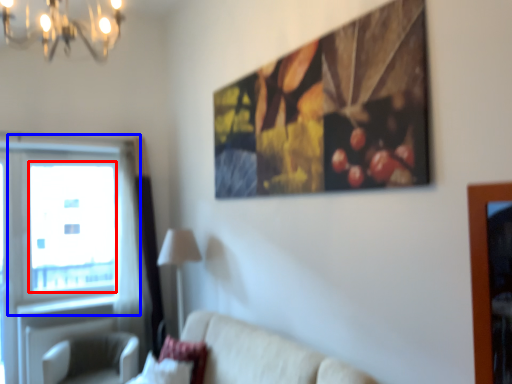
Question: Which of the following is the closest to the observer, window screen (highlighted by a red box) or window (highlighted by a blue box)?

Choices:
 (A) window screen
 (B) window

Answer: (B)